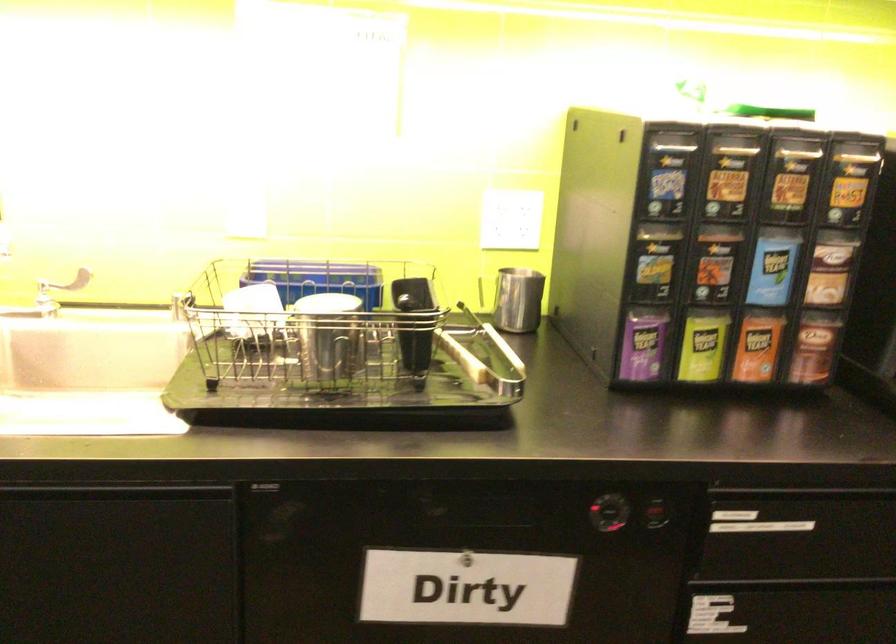
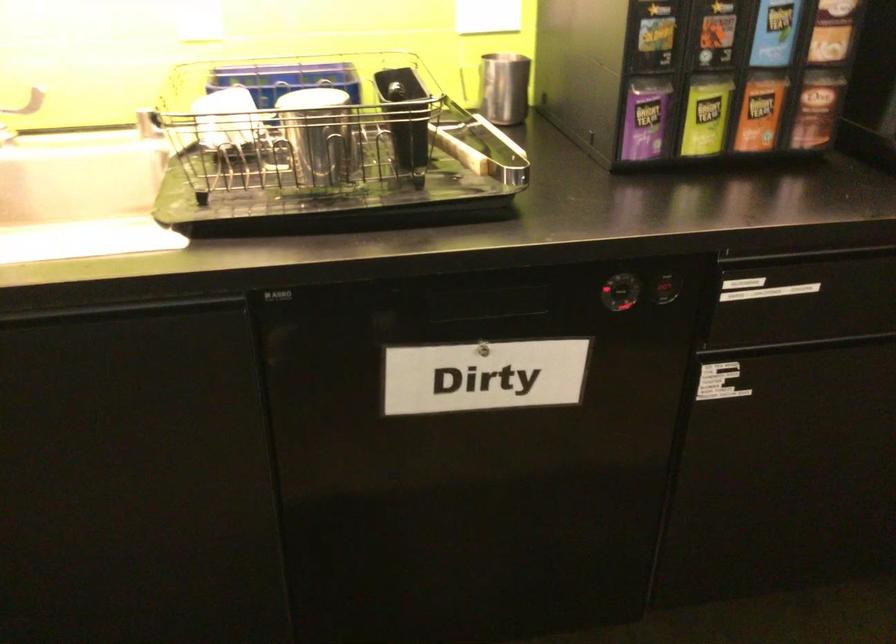
The point at [643,343] is marked in the first image. Where is the corresponding point in the second image?

(645, 118)